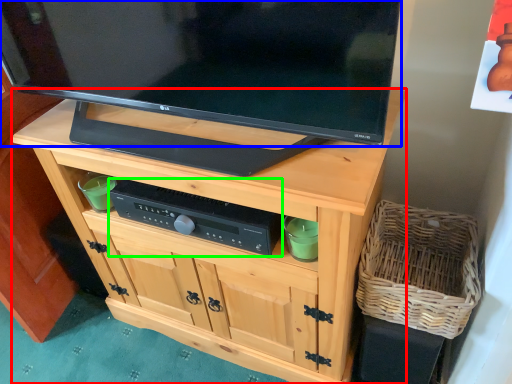
Question: Which is nearer to the cabinetry (highlighted by a red box)? television (highlighted by a blue box) or control (highlighted by a green box).

Choices:
 (A) television
 (B) control

Answer: (B)